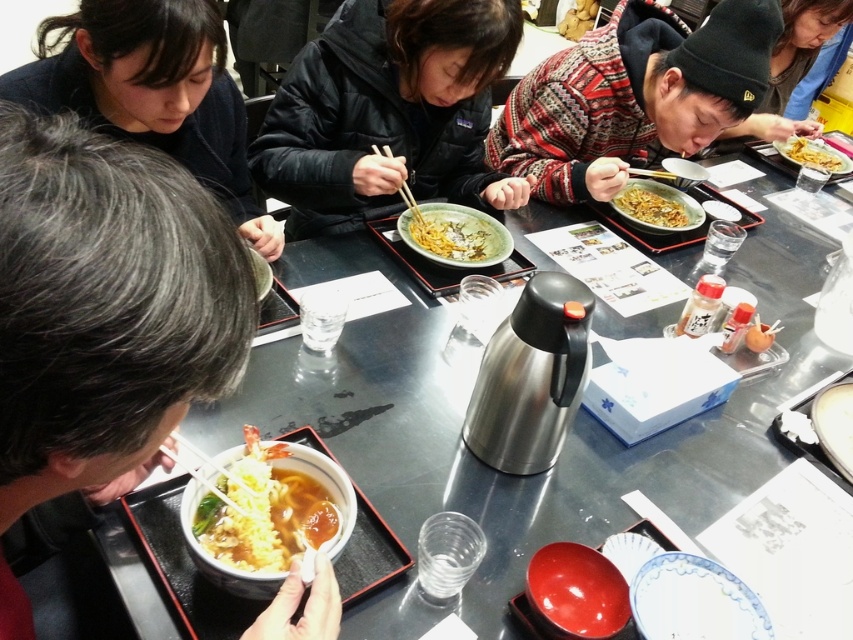
From the picture: You are a photographer trying to capture a closeup of the shiny yellow noodles at bottom left without including the black matte hair at upper left in the frame. Based on their positions, can you position yourself in a way that achieves this?

The black matte hair at upper left is above the shiny yellow noodles at bottom left, so if you position yourself lower and closer to the shiny yellow noodles at bottom left, you can avoid including the black matte hair at upper left in the frame.

You are a waiter at the restaurant and need to place a new dish on the table between the knitted sweater at center and the shiny silver bowl at center. Which side should you place it on to ensure it is between them?

The knitted sweater at center is on the left side of the shiny silver bowl at center, so placing the new dish to the right of the knitted sweater at center and to the left of the shiny silver bowl at center would place it between them.